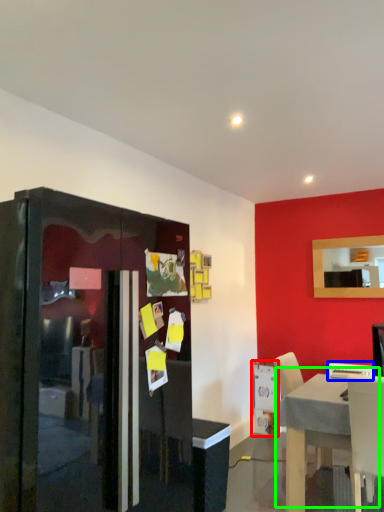
Question: Which is farther away from appliance (highlighted by a red box)? chair (highlighted by a blue box) or table (highlighted by a green box)?

Choices:
 (A) chair
 (B) table

Answer: (B)